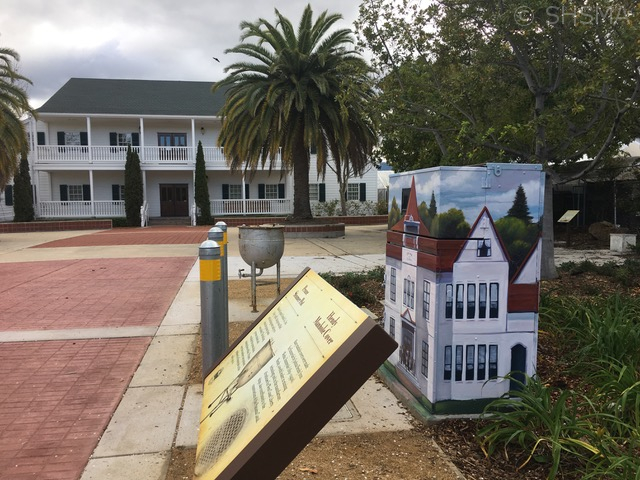
The height and width of the screenshot is (480, 640). In order to click on painting in this screenshot , I will do `click(451, 251)`.